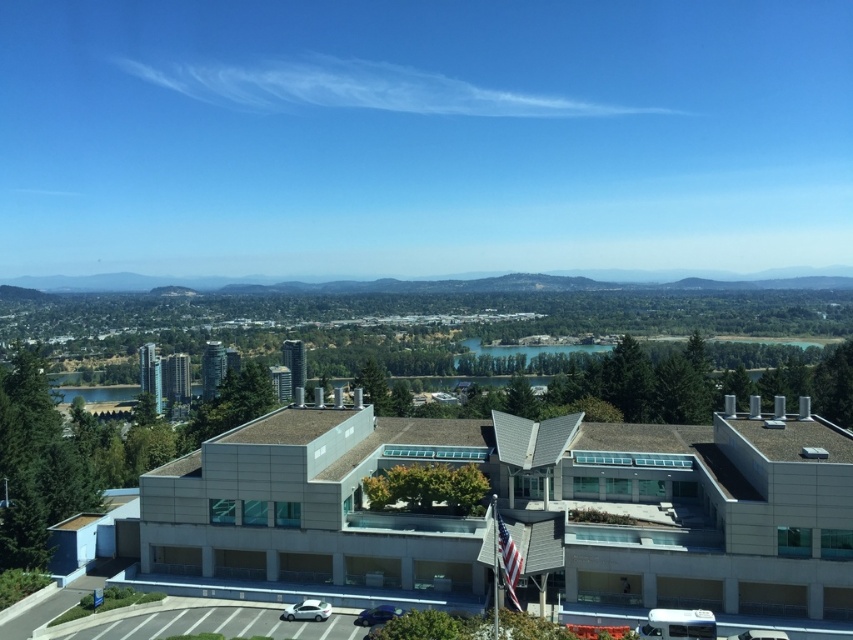
Question: Observing the image, what is the correct spatial positioning of white glossy sedan at center in reference to shiny blue sedan at lower center?

Choices:
 (A) above
 (B) below

Answer: (A)

Question: Does white glossy sedan at center lie in front of shiny blue sedan at lower center?

Choices:
 (A) no
 (B) yes

Answer: (A)

Question: Does white glossy sedan at center appear over shiny blue sedan at lower center?

Choices:
 (A) no
 (B) yes

Answer: (B)

Question: Among these points, which one is farthest from the camera?

Choices:
 (A) (287, 614)
 (B) (369, 625)

Answer: (A)

Question: Which object is closer to the camera taking this photo?

Choices:
 (A) white glossy sedan at center
 (B) shiny blue sedan at lower center

Answer: (B)